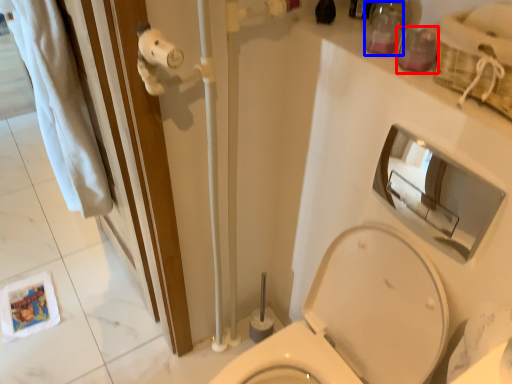
Question: Which object is further to the camera taking this photo, toiletry (highlighted by a red box) or toiletry (highlighted by a blue box)?

Choices:
 (A) toiletry
 (B) toiletry

Answer: (B)